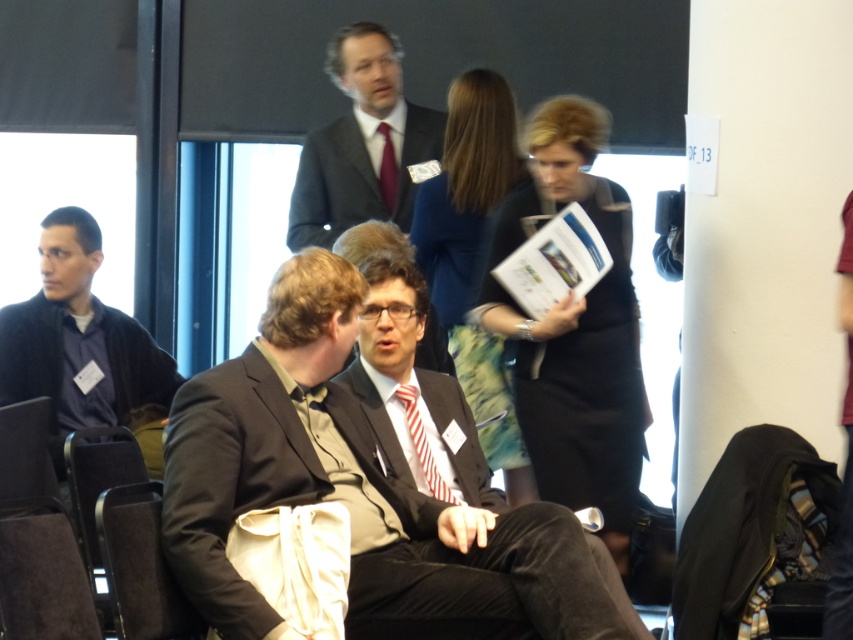
Can you confirm if dark gray sweater at left is positioned to the right of matte black suit at upper center?

In fact, dark gray sweater at left is to the left of matte black suit at upper center.

Does point (44, 236) come behind point (363, 166)?

That is False.

Between point (57, 300) and point (405, 150), which one is positioned in front?

Positioned in front is point (57, 300).

The image size is (853, 640). What are the coordinates of `dark gray sweater at left` in the screenshot? It's located at click(x=78, y=340).

Is matte black suit at center smaller than dark gray sweater at left?

Actually, matte black suit at center might be larger than dark gray sweater at left.

Who is positioned more to the right, matte black suit at center or dark gray sweater at left?

matte black suit at center

Between point (445, 404) and point (10, 332), which one is positioned in front?

Point (445, 404)

Where is `matte black suit at center`? matte black suit at center is located at coordinates (357, 496).

Is point (354, 160) closer to camera compared to point (378, 173)?

Yes, it is.

Where is `matte black suit at upper center`? This screenshot has width=853, height=640. matte black suit at upper center is located at coordinates (363, 144).